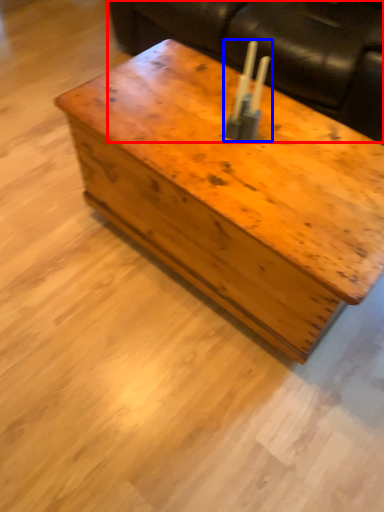
Question: Which of the following is the farthest to the observer, couch (highlighted by a red box) or candle holder (highlighted by a blue box)?

Choices:
 (A) couch
 (B) candle holder

Answer: (A)